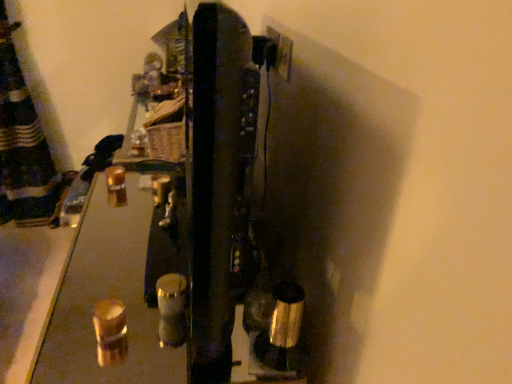
What do you see at coordinates (106, 298) in the screenshot? I see `metallic gold candle at lower left` at bounding box center [106, 298].

Image resolution: width=512 pixels, height=384 pixels. I want to click on metallic gold candle at lower left, so click(x=106, y=298).

Locate an element on the screen. metallic gold candle at lower left is located at coordinates (106, 298).